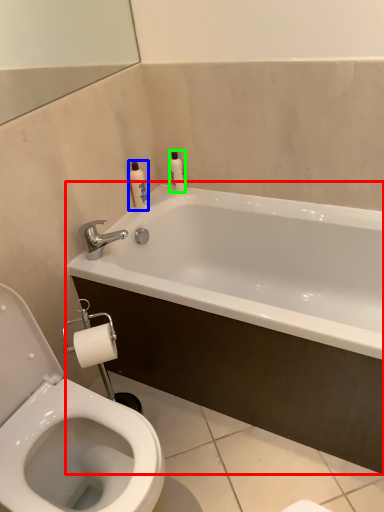
Question: Which object is positioned farthest from bathtub (highlighted by a red box)? Select from toiletry (highlighted by a blue box) and toiletry (highlighted by a green box).

Choices:
 (A) toiletry
 (B) toiletry

Answer: (B)